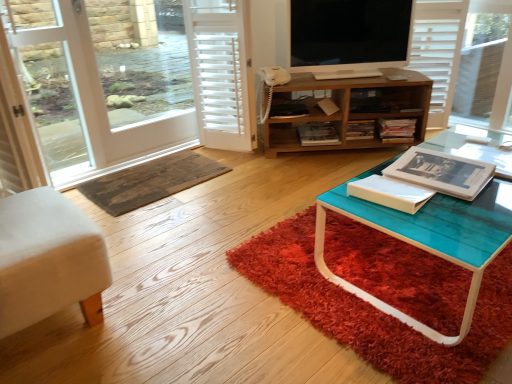
The height and width of the screenshot is (384, 512). Find the location of `free space in front of wooden textured doormat at center, the second doormat when ordered from right to left`. free space in front of wooden textured doormat at center, the second doormat when ordered from right to left is located at coordinates (164, 222).